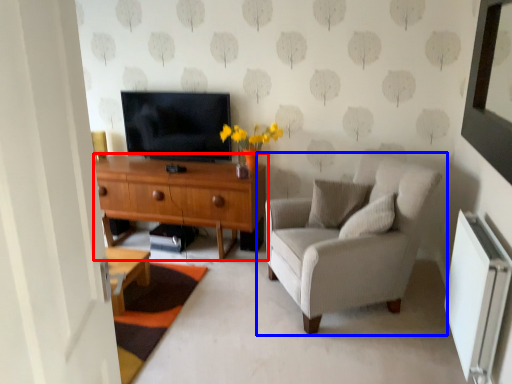
Question: Which point is further to the camera, desk (highlighted by a red box) or chair (highlighted by a blue box)?

Choices:
 (A) desk
 (B) chair

Answer: (A)